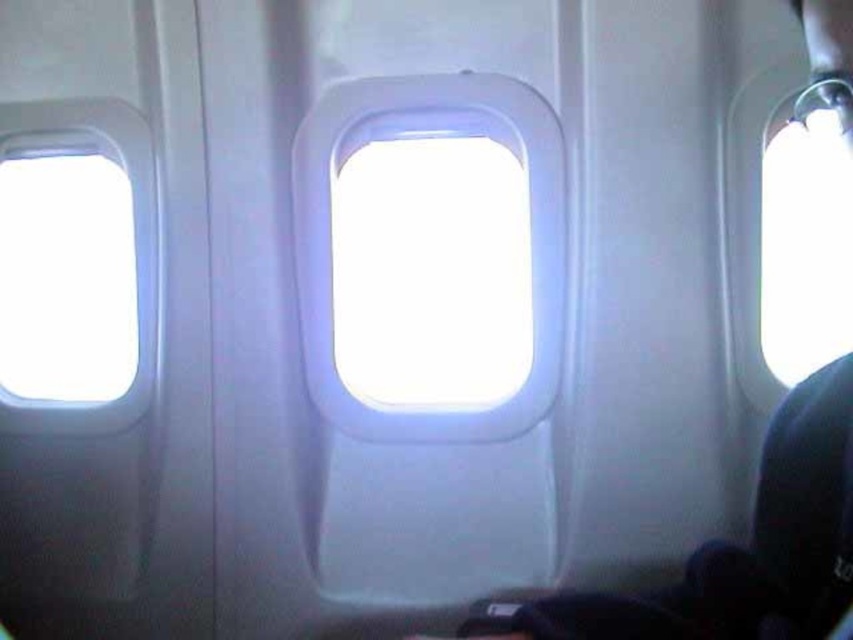
Question: Can you confirm if transparent plastic airplane window at center is positioned above transparent glass airplane window at left?

Choices:
 (A) no
 (B) yes

Answer: (B)

Question: Does transparent plastic airplane window at center have a lesser width compared to transparent glass airplane window at left?

Choices:
 (A) yes
 (B) no

Answer: (B)

Question: Which point is closer to the camera taking this photo?

Choices:
 (A) (32, 202)
 (B) (556, 289)

Answer: (B)

Question: Can you confirm if transparent plastic airplane window at center is thinner than transparent glass airplane window at left?

Choices:
 (A) no
 (B) yes

Answer: (A)